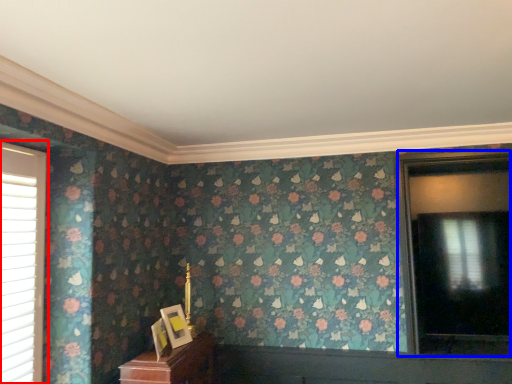
Question: Which object appears farthest to the camera in this image, window (highlighted by a red box) or window (highlighted by a blue box)?

Choices:
 (A) window
 (B) window

Answer: (B)